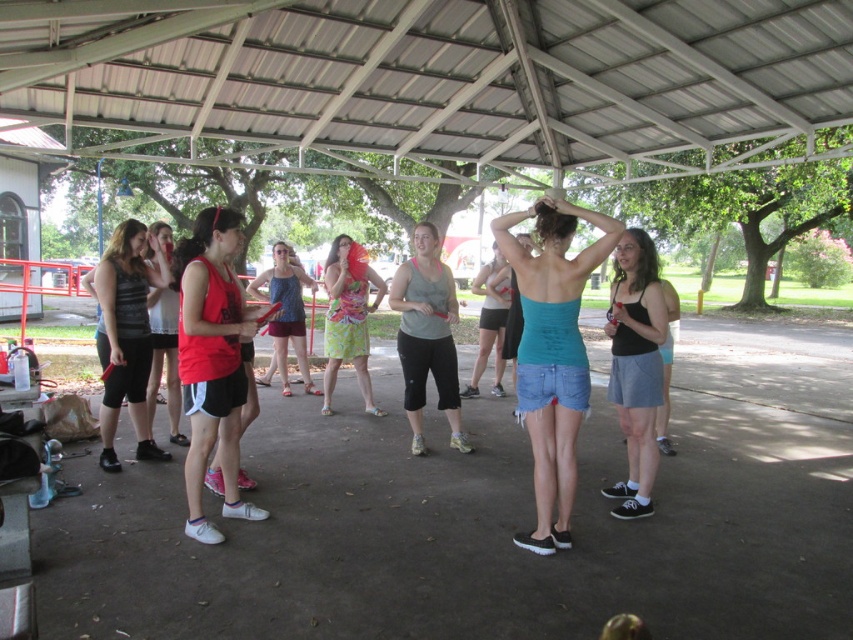
Question: Is black tank top at center in front of lime green floral dress at center?

Choices:
 (A) no
 (B) yes

Answer: (B)

Question: Is gray matte tank top at center positioned at the back of matte red tank top at center?

Choices:
 (A) no
 (B) yes

Answer: (B)

Question: Does black tank top at center appear on the left side of matte red tank top at center?

Choices:
 (A) no
 (B) yes

Answer: (A)

Question: Which point is closer to the camera?

Choices:
 (A) (352, 278)
 (B) (264, 275)
 (C) (161, 355)
 (D) (212, 392)

Answer: (D)

Question: Which of the following is the closest to the observer?

Choices:
 (A) (567, 477)
 (B) (180, 444)

Answer: (A)

Question: Among these points, which one is nearest to the camera?

Choices:
 (A) (137, 404)
 (B) (461, 435)

Answer: (A)